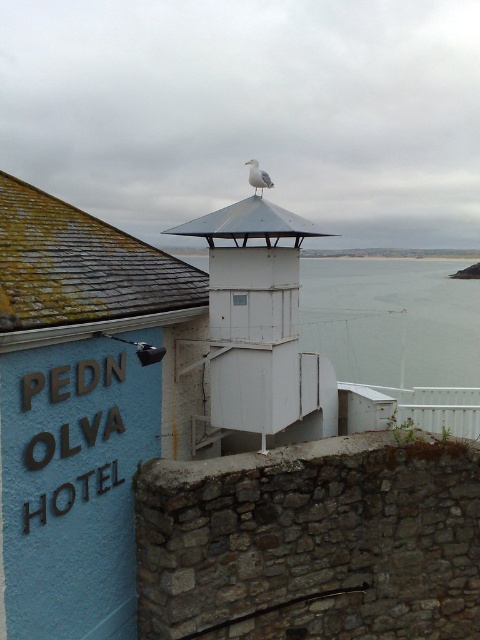
You are a tourist standing in front of the PEDN OLVA HOTEL. You want to take a photo that includes both the white matte tower at center and the transparent glass water at center. Which object should you place on the left side of your camera frame to ensure both are visible?

You should place the white matte tower at center on the left side of your camera frame since it is already positioned on the left side of the transparent glass water at center, ensuring both are visible.

You are a photographer planning to take a photo of the PEDN OLVA HOTEL and the surrounding area. You want to ensure both the white matte tower at center and the white feathered bird at upper center are clearly visible in the frame. Given their sizes, which object might require you to adjust your camera settings to focus more carefully?

The white feathered bird at upper center might require more careful focus adjustment because it is smaller in size compared to the white matte tower at center.